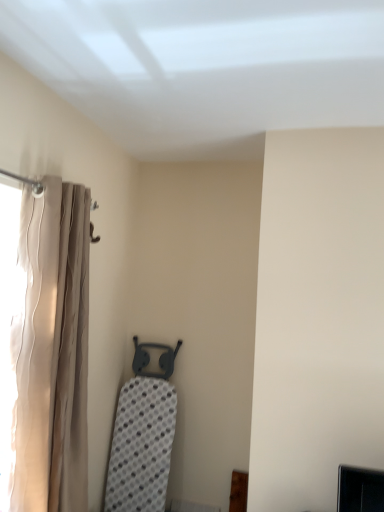
Image resolution: width=384 pixels, height=512 pixels. I want to click on beige fabric curtain at left, so pyautogui.click(x=52, y=350).

This screenshot has height=512, width=384. Describe the element at coordinates (52, 350) in the screenshot. I see `beige fabric curtain at left` at that location.

Identify the location of beige fabric curtain at left. This screenshot has height=512, width=384. click(x=52, y=350).